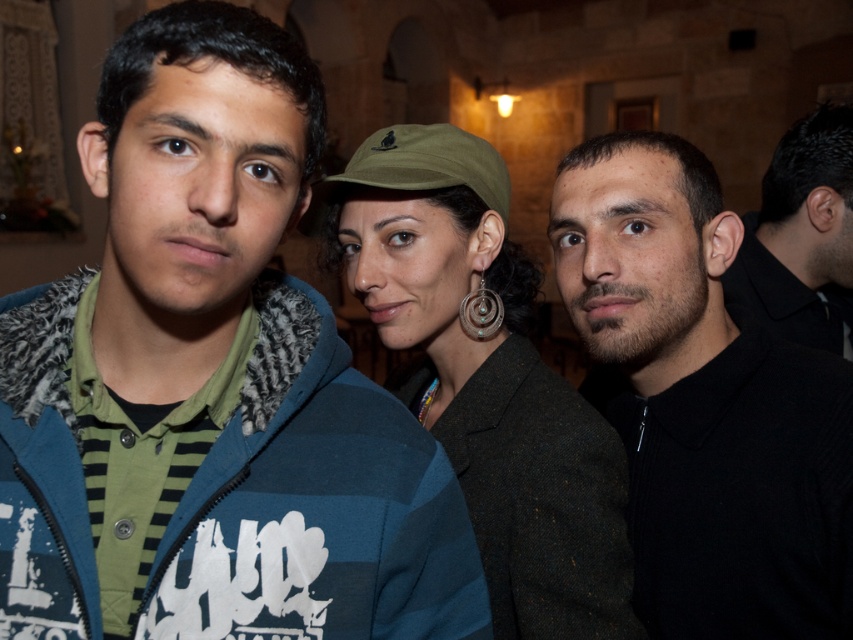
Question: Considering the relative positions of blue striped hoodie at center and black matte shirt at center in the image provided, where is blue striped hoodie at center located with respect to black matte shirt at center?

Choices:
 (A) left
 (B) right

Answer: (A)

Question: Which object is closer to the camera taking this photo?

Choices:
 (A) black matte shirt at center
 (B) blue striped hoodie at center

Answer: (B)

Question: In this image, where is black matte shirt at center located relative to green fabric cap at center?

Choices:
 (A) right
 (B) left

Answer: (A)

Question: Which point is closer to the camera?

Choices:
 (A) black matte shirt at center
 (B) black matte ear at right
 (C) blue striped hoodie at center

Answer: (C)

Question: Can you confirm if blue striped hoodie at center is positioned to the left of black matte ear at right?

Choices:
 (A) yes
 (B) no

Answer: (A)

Question: Estimate the real-world distances between objects in this image. Which object is closer to the green fabric cap at center?

Choices:
 (A) black matte shirt at center
 (B) black matte ear at right

Answer: (A)